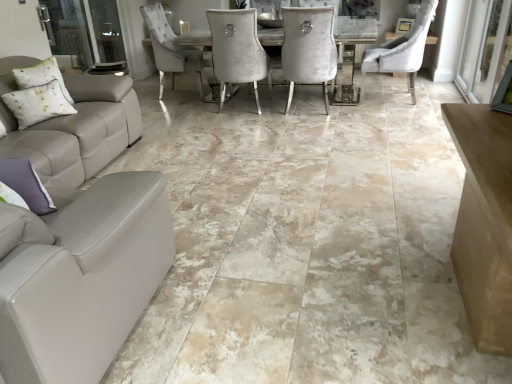
Locate an element on the screen. The height and width of the screenshot is (384, 512). vacant space to the right of velvet white chair at center, placed as the first chair when sorted from left to right is located at coordinates (354, 109).